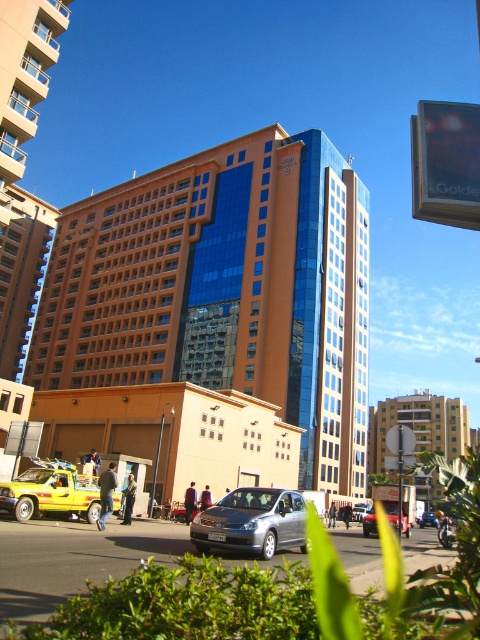
Does yellow matte taxi at lower left have a greater width compared to silver metallic sedan at center?

Incorrect, yellow matte taxi at lower left's width does not surpass silver metallic sedan at center's.

Between yellow matte taxi at lower left and silver metallic sedan at center, which one appears on the left side from the viewer's perspective?

yellow matte taxi at lower left is more to the left.

This screenshot has height=640, width=480. Identify the location of yellow matte taxi at lower left. (50, 492).

In order to click on yellow matte taxi at lower left in this screenshot , I will do 50,492.

Between satin silver car at center and yellow matte taxi at lower left, which one has less height?

With less height is yellow matte taxi at lower left.

Which is more to the right, satin silver car at center or yellow matte taxi at lower left?

satin silver car at center is more to the right.

Does point (251, 486) lie behind point (17, 490)?

Yes.

Find the location of a particular element. This screenshot has height=640, width=480. satin silver car at center is located at coordinates (252, 522).

Who is taller, metallic silver sedan at center or silver metallic car at center?

Standing taller between the two is silver metallic car at center.

Is metallic silver sedan at center positioned at the back of silver metallic car at center?

No.

Where is `metallic silver sedan at center`? This screenshot has width=480, height=640. metallic silver sedan at center is located at coordinates (370, 522).

Locate an element on the screen. metallic silver sedan at center is located at coordinates (370, 522).